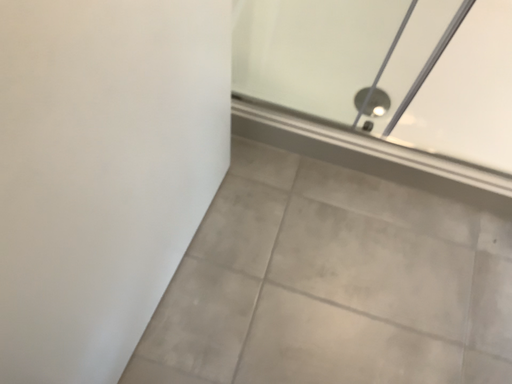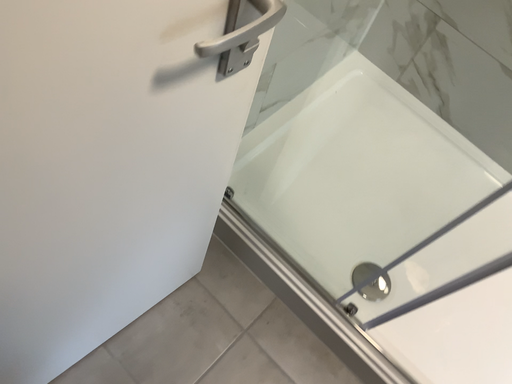
Question: How did the camera likely rotate when shooting the video?

Choices:
 (A) rotated downward
 (B) rotated upward

Answer: (B)